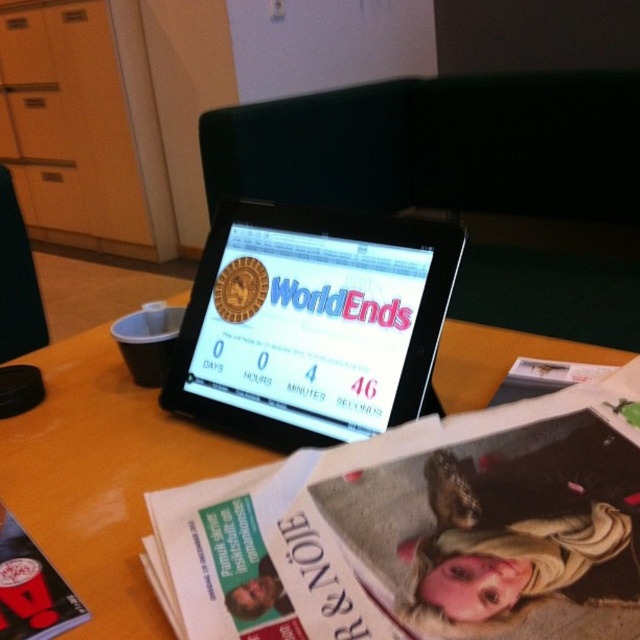
Question: Which object is the closest to the matte black magazine at lower left?

Choices:
 (A) black glossy tablet at center
 (B) wooden table at center

Answer: (A)

Question: Can you confirm if wooden table at center is positioned above matte black magazine at lower left?

Choices:
 (A) no
 (B) yes

Answer: (B)

Question: Which point appears farthest from the camera in this image?

Choices:
 (A) (33, 611)
 (B) (115, 589)

Answer: (B)

Question: Is wooden table at center thinner than matte black magazine at lower left?

Choices:
 (A) no
 (B) yes

Answer: (A)

Question: Which object is farther from the camera taking this photo?

Choices:
 (A) wooden table at center
 (B) black glossy tablet at center

Answer: (A)

Question: Does wooden table at center have a greater width compared to matte black magazine at lower left?

Choices:
 (A) yes
 (B) no

Answer: (A)